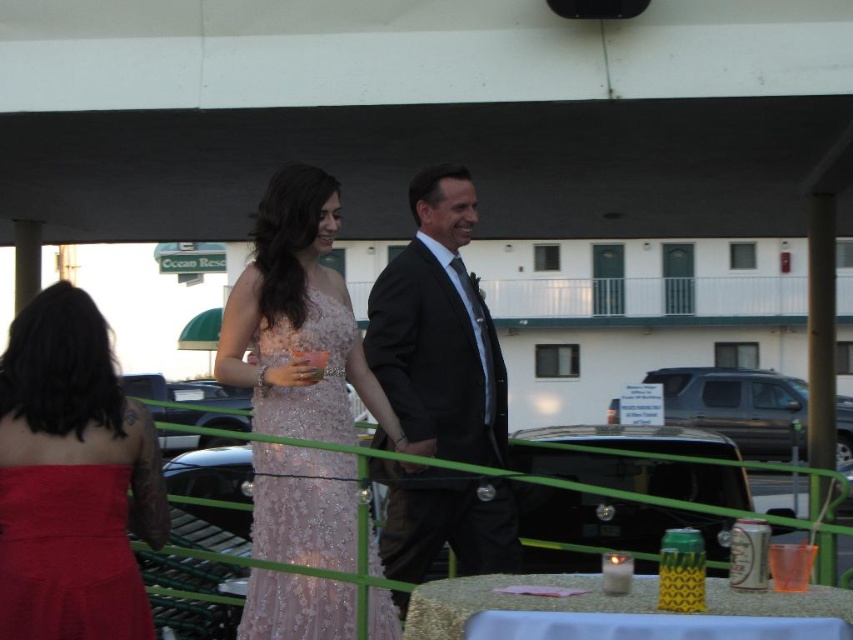
Question: Which point is farther to the camera?

Choices:
 (A) black satin suit at center
 (B) matte red dress at left
 (C) metallic gold ring at center
 (D) sequined fabric dress at center

Answer: (A)

Question: Among these objects, which one is nearest to the camera?

Choices:
 (A) metallic gold ring at center
 (B) gold glitter tablecloth at lower center

Answer: (B)

Question: Where is sequined fabric dress at center located in relation to matte red dress at left in the image?

Choices:
 (A) right
 (B) left

Answer: (A)

Question: Can you confirm if matte red dress at lower left is positioned above translucent orange cup at lower right?

Choices:
 (A) no
 (B) yes

Answer: (A)

Question: Which point appears farthest from the camera in this image?

Choices:
 (A) (427, 536)
 (B) (788, 573)

Answer: (A)

Question: Does matte red dress at lower left appear under gold glitter tablecloth at lower center?

Choices:
 (A) no
 (B) yes

Answer: (A)